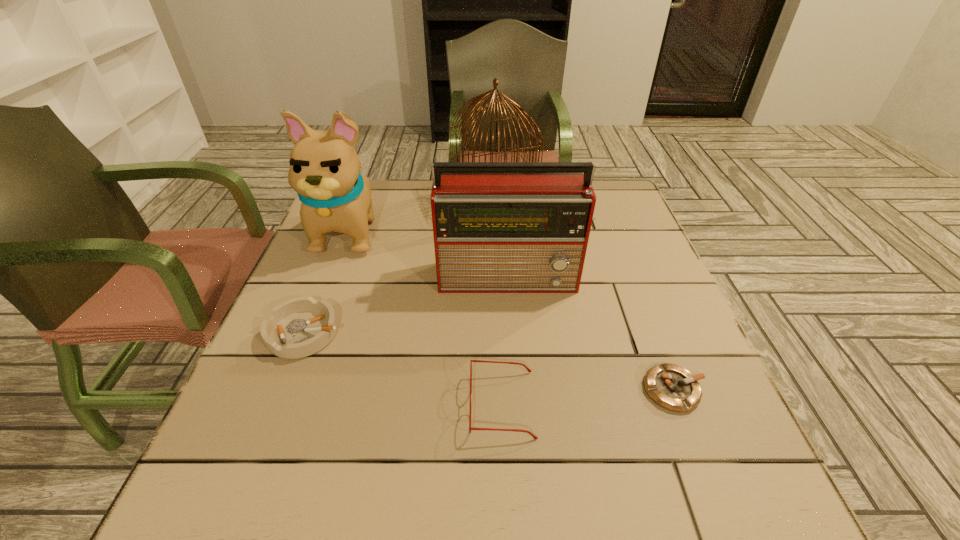
At what (x,y) coordinates should I click in order to perform the action: click on free spot located 0.310m on the front-facing side of the radio receiver. Please return your answer as a coordinate pair (x, y). This screenshot has height=540, width=960. Looking at the image, I should click on (522, 421).

The width and height of the screenshot is (960, 540). I want to click on free region located 0.340m on the face of the third shortest object, so click(277, 404).

Find the location of a particular element. The width and height of the screenshot is (960, 540). vacant space located 0.330m on the face of the third shortest object is located at coordinates (283, 404).

Where is `vacant space located 0.210m on the face of the third shortest object`? The width and height of the screenshot is (960, 540). vacant space located 0.210m on the face of the third shortest object is located at coordinates (351, 404).

Where is `vacant position located on the right of the left ashtray`? This screenshot has height=540, width=960. vacant position located on the right of the left ashtray is located at coordinates (405, 333).

The width and height of the screenshot is (960, 540). In order to click on free space located on the back of the right ashtray in this screenshot , I will do `click(628, 272)`.

At what (x,y) coordinates should I click in order to perform the action: click on birdcage that is at the far edge. Please return your answer as a coordinate pair (x, y). The height and width of the screenshot is (540, 960). Looking at the image, I should click on (477, 101).

The width and height of the screenshot is (960, 540). Identify the location of puppy situated at the far edge. (324, 169).

Find the location of `puppy positioned at the left edge`. puppy positioned at the left edge is located at coordinates (324, 169).

The height and width of the screenshot is (540, 960). Find the location of `ashtray located in the left edge section of the desktop`. ashtray located in the left edge section of the desktop is located at coordinates 299,327.